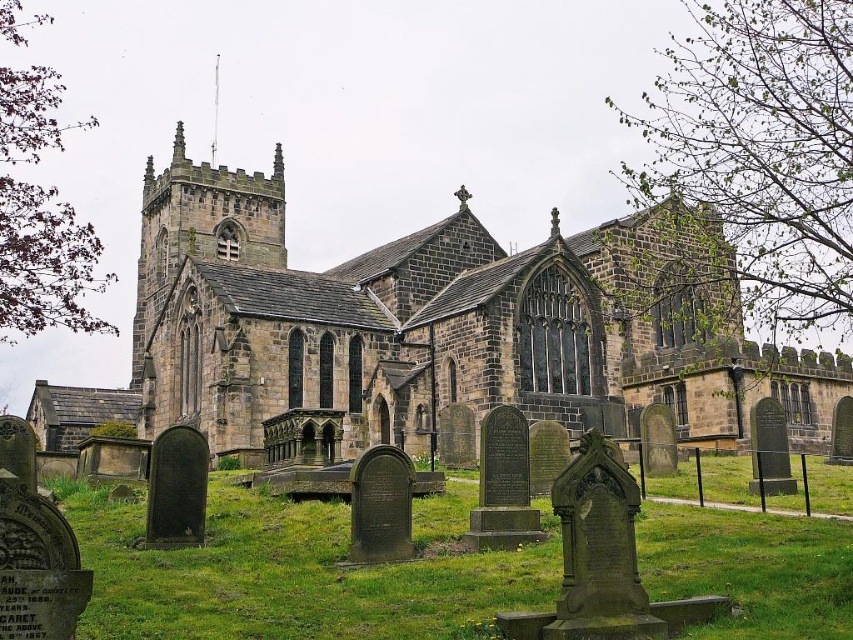
Between stone church at center and green grass at lower center, which one appears on the right side from the viewer's perspective?

Positioned to the right is green grass at lower center.

Is stone church at center thinner than green grass at lower center?

No.

The image size is (853, 640). I want to click on stone church at center, so click(x=416, y=330).